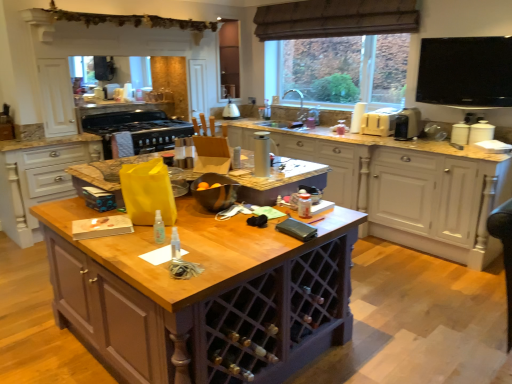
Locate an element on the screen. vacant space in front of beige plastic toaster at upper right, which is counted as the third appliance, starting from the right is located at coordinates (379, 136).